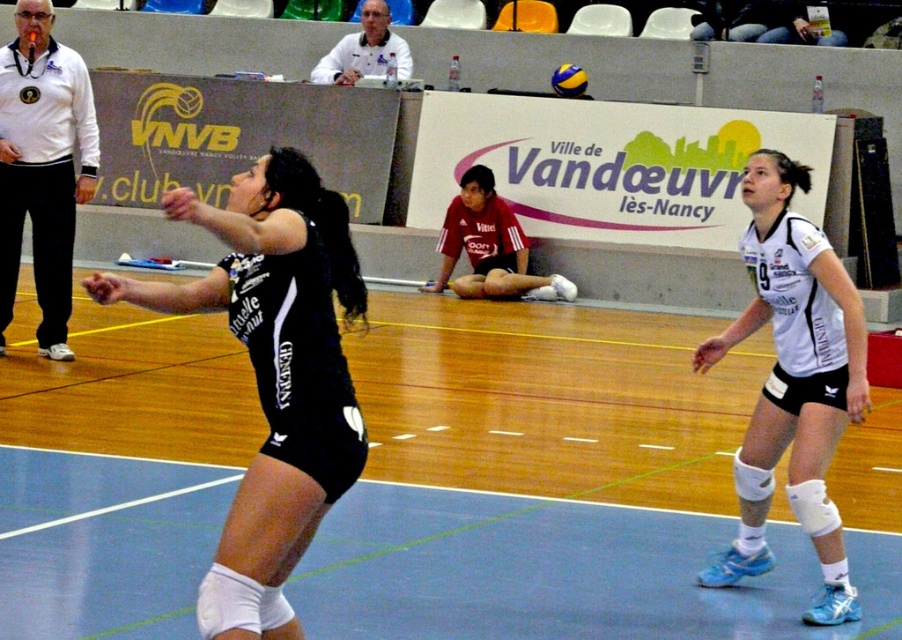
You are a referee observing a volleyball match. You need to determine if the black matte uniform at center is positioned higher than the yellow matte volleyball at center. Based on the scene, what can you conclude?

The black matte uniform at center is taller than the yellow matte volleyball at center, so the black matte uniform at center is positioned higher than the yellow matte volleyball at center.